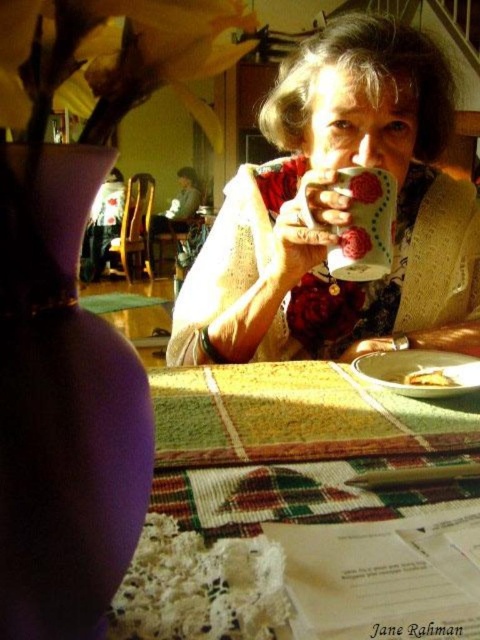
Is purple matte vase at left shorter than lace fabric flower at lower left?

Incorrect, purple matte vase at left's height does not fall short of lace fabric flower at lower left's.

Can you confirm if purple matte vase at left is thinner than lace fabric flower at lower left?

Yes, purple matte vase at left is thinner than lace fabric flower at lower left.

Measure the distance between point (47, 515) and camera.

Result: A distance of 18.85 centimeters exists between point (47, 515) and camera.

Find the location of a particular element. This screenshot has width=480, height=640. purple matte vase at left is located at coordinates coord(62,410).

Is multicolored woven tablecloth at center thinner than lace fabric flower at lower left?

No.

Is point (422, 484) more distant than point (265, 595)?

Yes, it is.

Where is `multicolored woven tablecloth at center`? This screenshot has width=480, height=640. multicolored woven tablecloth at center is located at coordinates (303, 509).

Who is lower down, yellow matte flower at upper left or matte ceramic mug at center?

Positioned lower is matte ceramic mug at center.

This screenshot has height=640, width=480. What do you see at coordinates (110, 60) in the screenshot?
I see `yellow matte flower at upper left` at bounding box center [110, 60].

Who is more forward, [62,33] or [302,205]?

Point [62,33]

Where is `yellow matte flower at upper left`? Image resolution: width=480 pixels, height=640 pixels. yellow matte flower at upper left is located at coordinates (110, 60).